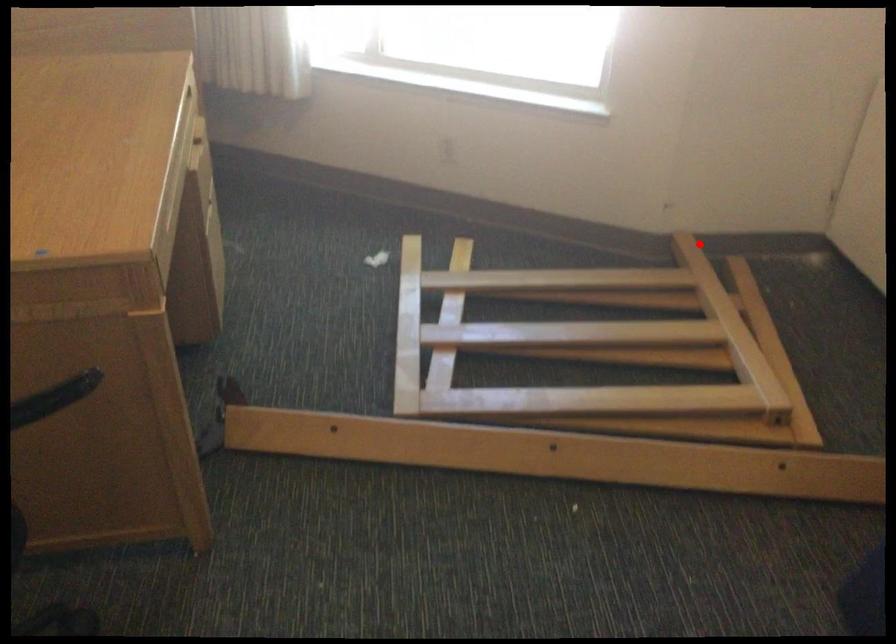
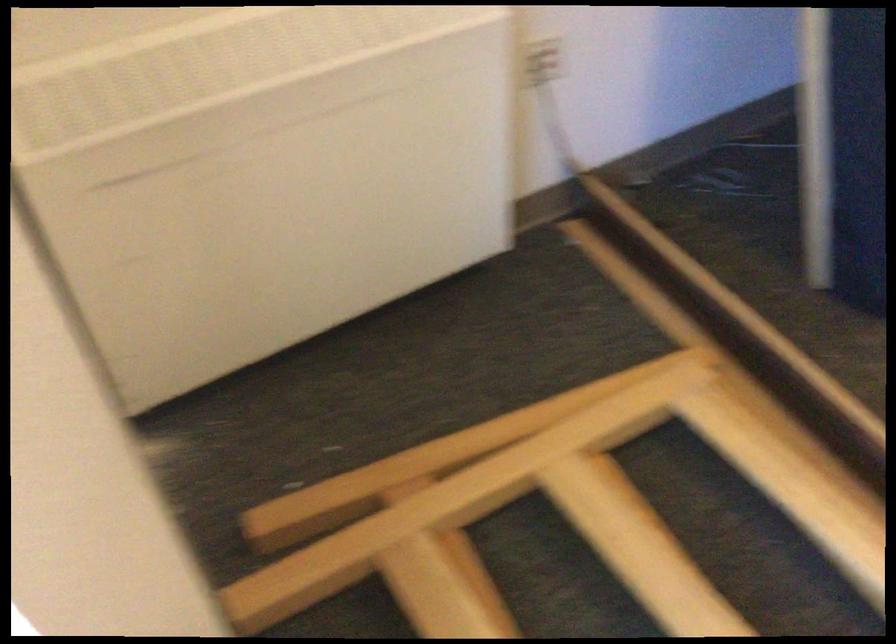
Where in the second image is the point corresponding to the highlighted location from the first image?

(313, 545)